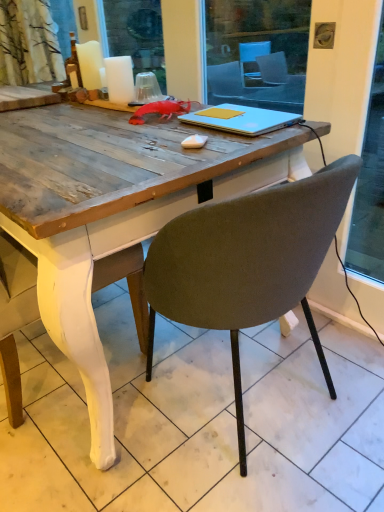
This screenshot has height=512, width=384. I want to click on free space in front of yellow matte notebook at center, which is the 2th notebook from bottom to top, so click(227, 121).